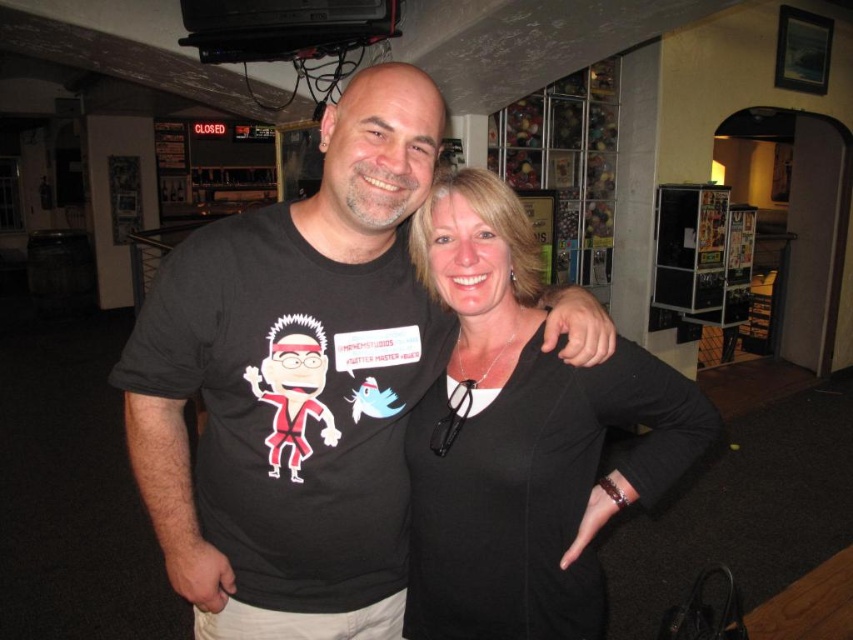
Between black matte t-shirt at center and black matte shirt at center, which one has less height?

Standing shorter between the two is black matte shirt at center.

Is black matte t-shirt at center below black matte shirt at center?

Incorrect, black matte t-shirt at center is not positioned below black matte shirt at center.

Find the location of a particular element. This screenshot has height=640, width=853. black matte t-shirt at center is located at coordinates (294, 385).

Identify the location of black matte t-shirt at center. This screenshot has width=853, height=640. (294, 385).